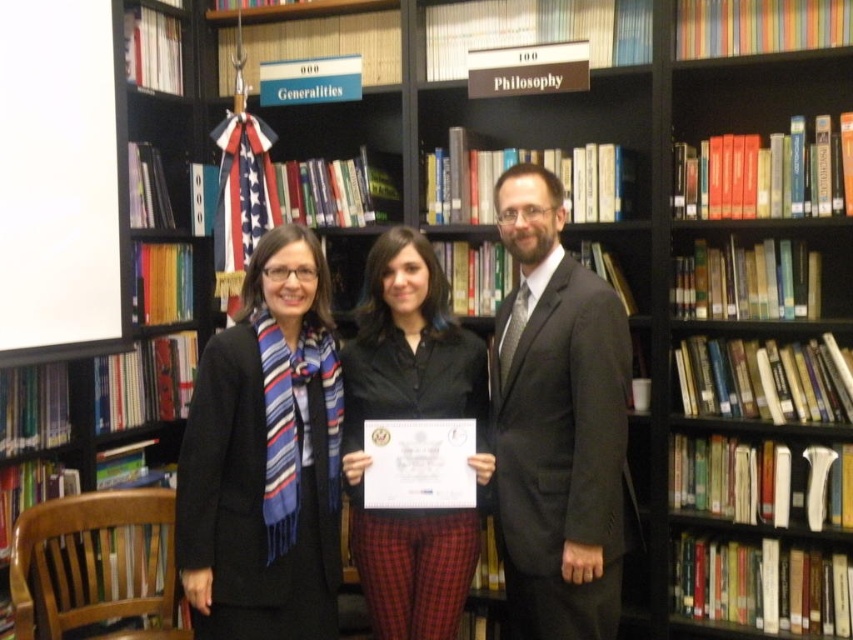
You are a photographer setting up for a group photo in the library. You need to position the blue striped scarf at center and the black matte shirt at center correctly based on their current positions. Which object should be placed to the left when arranging them side by side?

The blue striped scarf at center should be placed to the left of the black matte shirt at center because the blue striped scarf at center is currently to the left of the black matte shirt at center.

You are standing in the library scene described. There is a point marked at coordinates (265, 458). Which object is located at this point?

The point at coordinates (265, 458) indicates the blue striped scarf at center.

You are organizing a formal event and need to decide which item to display based on their sizes. Given the blue striped scarf at center and dark gray suit at center, which one has a larger width?

The blue striped scarf at center has a larger width than the dark gray suit at center according to the description.